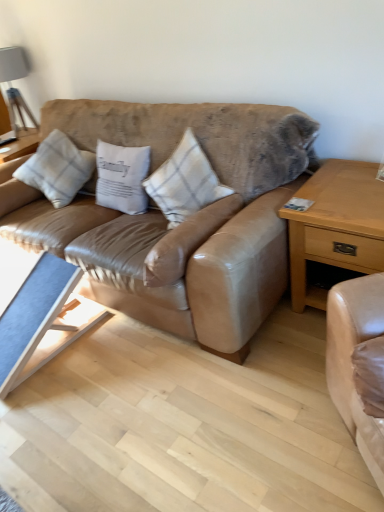
This screenshot has height=512, width=384. I want to click on free space in front of leather couch at center, so click(x=157, y=408).